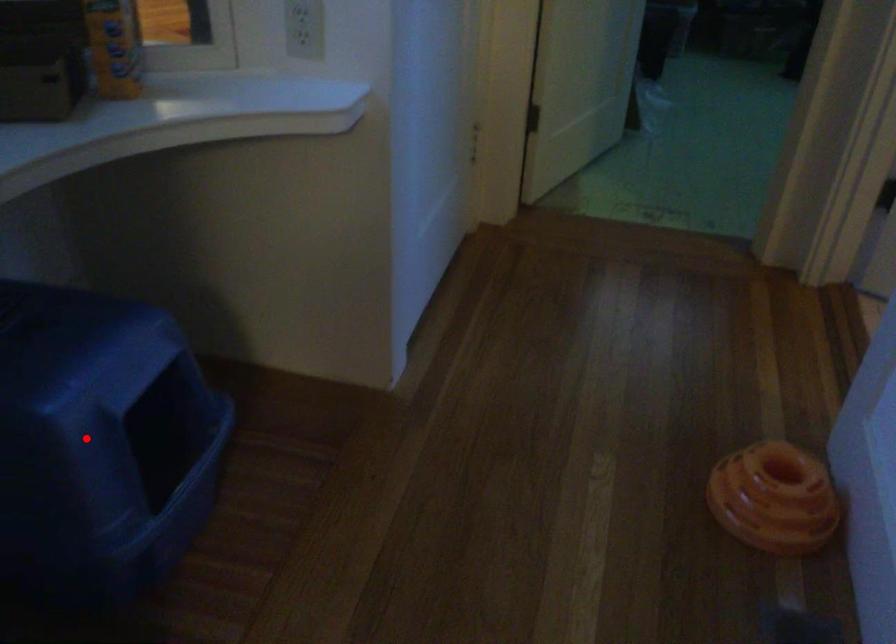
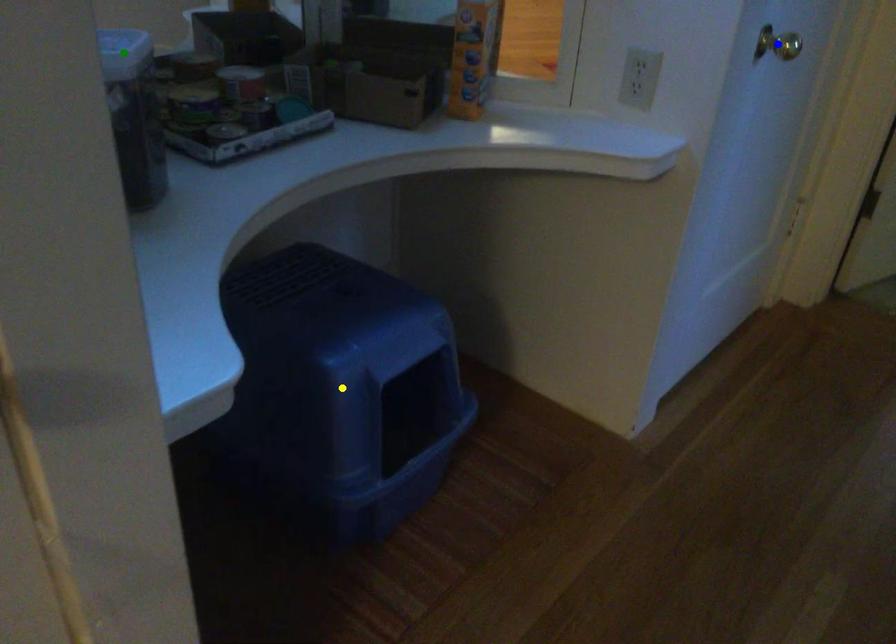
Question: I am providing you with two images of the same scene from different viewpoints. A red point is marked on the first image. You are given multiple points on the second image. Which point in image 2 is actually the same real-world point as the red point in image 1?

Choices:
 (A) yellow point
 (B) green point
 (C) blue point

Answer: (A)